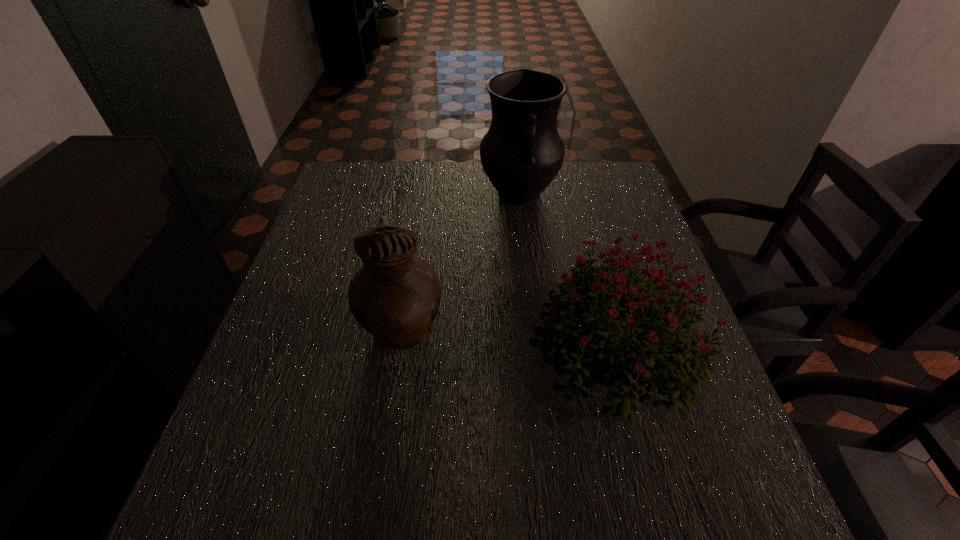
Find the location of `vacant area that lies between the nearer pitcher and the farthest object`. vacant area that lies between the nearer pitcher and the farthest object is located at coordinates (460, 265).

You are a GUI agent. You are given a task and a screenshot of the screen. Output one action in this format:
    pyautogui.click(x=<x>, y=<y>)
    Task: Click on the vacant region between the nearer pitcher and the farthest object
    The image size is (960, 540).
    Given the screenshot: What is the action you would take?
    pyautogui.click(x=460, y=265)

Find the location of a particular element. The image size is (960, 540). free area in between the nearer pitcher and the farthest object is located at coordinates (460, 265).

Find the location of a particular element. Image resolution: width=960 pixels, height=540 pixels. free space between the nearer pitcher and the farther pitcher is located at coordinates (460, 265).

Find the location of `object that is the closest to the bouquet`. object that is the closest to the bouquet is located at coordinates (395, 296).

Find the location of a particular element. The image size is (960, 540). object that stands as the second closest to the bouquet is located at coordinates (522, 152).

Find the location of a particular element. blank area in the image that satisfies the following two spatial constraints: 1. on the handle side of the farthest object; 2. at the spout of the left pitcher is located at coordinates (534, 335).

Find the location of a particular element. Image resolution: width=960 pixels, height=540 pixels. blank area in the image that satisfies the following two spatial constraints: 1. at the spout of the bouquet; 2. on the right side of the nearer pitcher is located at coordinates (398, 352).

This screenshot has height=540, width=960. I want to click on vacant space that satisfies the following two spatial constraints: 1. on the back side of the bouquet; 2. at the spout of the leftmost object, so 608,335.

Where is `free location that satisfies the following two spatial constraints: 1. on the handle side of the farther pitcher; 2. on the right side of the bouquet`? free location that satisfies the following two spatial constraints: 1. on the handle side of the farther pitcher; 2. on the right side of the bouquet is located at coordinates (536, 352).